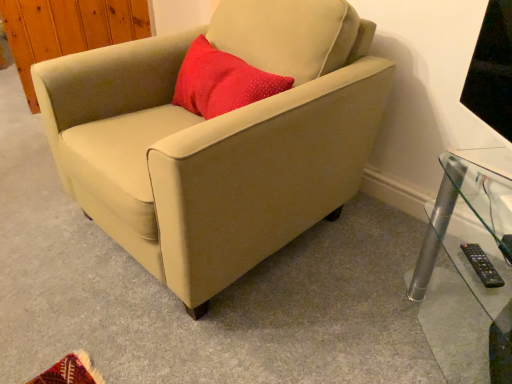
What is the approximate height of black plastic remote at lower right?

The height of black plastic remote at lower right is 1.06 inches.

Locate an element on the screen. black plastic remote at lower right is located at coordinates (482, 265).

Locate an element on the screen. Image resolution: width=512 pixels, height=384 pixels. black plastic remote at lower right is located at coordinates (482, 265).

Which point is more distant from viewer, (126,66) or (489,280)?

Point (126,66)

Find the location of `remote below the beige fabric chair at center (from the image's perspective)`. remote below the beige fabric chair at center (from the image's perspective) is located at coordinates (482, 265).

Does beige fabric chair at center appear on the left side of black plastic remote at lower right?

Indeed, beige fabric chair at center is positioned on the left side of black plastic remote at lower right.

From a real-world perspective, is beige fabric chair at center physically above black plastic remote at lower right?

Indeed, from a real-world perspective, beige fabric chair at center stands above black plastic remote at lower right.

Is clear glass table at lower right positioned with its back to beige fabric chair at center?

No, clear glass table at lower right is not facing away from beige fabric chair at center.

Is clear glass table at lower right positioned in front of beige fabric chair at center?

Yes, it is.

In terms of height, does clear glass table at lower right look taller or shorter compared to beige fabric chair at center?

Considering their sizes, clear glass table at lower right has less height than beige fabric chair at center.

How different are the orientations of black plastic remote at lower right and beige fabric chair at center in degrees?

The angle between the facing direction of black plastic remote at lower right and the facing direction of beige fabric chair at center is 42.1 degrees.

Is black plastic remote at lower right bigger than beige fabric chair at center?

No.

Could you tell me if black plastic remote at lower right is facing beige fabric chair at center?

No, black plastic remote at lower right is not facing towards beige fabric chair at center.

From a real-world perspective, between black plastic remote at lower right and clear glass table at lower right, who is vertically lower?

From a 3D spatial view, clear glass table at lower right is below.

Is clear glass table at lower right at the back of black plastic remote at lower right?

Yes, black plastic remote at lower right is facing away from clear glass table at lower right.

Is black plastic remote at lower right not near clear glass table at lower right?

No.

From the image's perspective, who appears lower, black plastic remote at lower right or clear glass table at lower right?

clear glass table at lower right is shown below in the image.

From a real-world perspective, does beige fabric chair at center sit lower than clear glass table at lower right?

No.

From the image's perspective, would you say beige fabric chair at center is positioned over clear glass table at lower right?

Correct, beige fabric chair at center appears higher than clear glass table at lower right in the image.

Which is behind, point (245, 112) or point (489, 171)?

The point (245, 112) is more distant.

Can we say beige fabric chair at center lies outside clear glass table at lower right?

Yes.

Is clear glass table at lower right positioned far away from black plastic remote at lower right?

No, clear glass table at lower right is not far from black plastic remote at lower right.

Is clear glass table at lower right at the left side of black plastic remote at lower right?

No, clear glass table at lower right is not to the left of black plastic remote at lower right.

From the image's perspective, between clear glass table at lower right and black plastic remote at lower right, who is located below?

clear glass table at lower right appears lower in the image.

Is clear glass table at lower right located outside black plastic remote at lower right?

Yes, clear glass table at lower right is not within black plastic remote at lower right.

Find the location of `chair in front of the black plastic remote at lower right`. chair in front of the black plastic remote at lower right is located at coordinates (217, 140).

The height and width of the screenshot is (384, 512). What are the coordinates of `chair above the clear glass table at lower right (from a real-world perspective)` in the screenshot? It's located at (217, 140).

From the image, which object appears to be farther from beige fabric chair at center, black plastic remote at lower right or clear glass table at lower right?

black plastic remote at lower right is further to beige fabric chair at center.

Based on their spatial positions, is clear glass table at lower right or beige fabric chair at center closer to black plastic remote at lower right?

clear glass table at lower right.

Based on the photo, estimate the real-world distances between objects in this image. Which object is further from clear glass table at lower right, black plastic remote at lower right or beige fabric chair at center?

The object further to clear glass table at lower right is beige fabric chair at center.

Estimate the real-world distances between objects in this image. Which object is closer to clear glass table at lower right, beige fabric chair at center or black plastic remote at lower right?

black plastic remote at lower right lies closer to clear glass table at lower right than the other object.

Considering their positions, is clear glass table at lower right positioned closer to beige fabric chair at center than black plastic remote at lower right?

clear glass table at lower right is closer to beige fabric chair at center.

When comparing their distances from black plastic remote at lower right, does beige fabric chair at center or clear glass table at lower right seem further?

The object further to black plastic remote at lower right is beige fabric chair at center.

Identify the location of remote between beige fabric chair at center and clear glass table at lower right. Image resolution: width=512 pixels, height=384 pixels. (482, 265).